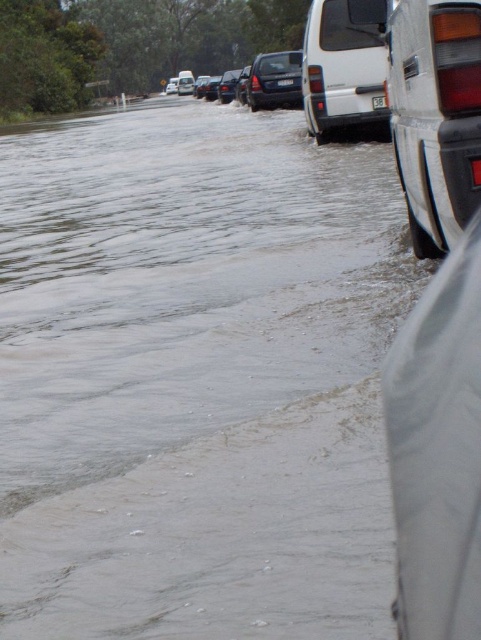
Question: Considering the relative positions of white matte van at center and black glossy sedan at center in the image provided, where is white matte van at center located with respect to black glossy sedan at center?

Choices:
 (A) above
 (B) below

Answer: (B)

Question: Can you confirm if matte black suv at right is positioned to the right of white matte van at center?

Choices:
 (A) yes
 (B) no

Answer: (B)

Question: Which point is farther from the camera taking this photo?

Choices:
 (A) (289, 65)
 (B) (308, 40)
 (C) (228, 76)
 (D) (215, 96)

Answer: (D)

Question: Is white matte van at center below shiny metallic sedan at center?

Choices:
 (A) yes
 (B) no

Answer: (A)

Question: Which point is closer to the camera?

Choices:
 (A) (278, 70)
 (B) (235, 84)

Answer: (A)

Question: Which object is positioned farthest from the white matte van at center?

Choices:
 (A) matte black suv at right
 (B) black glossy sedan at center
 (C) shiny black suv at center
 (D) shiny metallic sedan at center

Answer: (B)